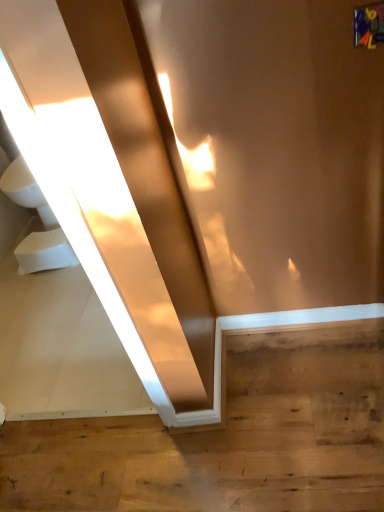
Question: Does white foam toilet bowl at lower left have a greater width compared to wooden floor at lower right?

Choices:
 (A) no
 (B) yes

Answer: (A)

Question: Does white foam toilet bowl at lower left touch wooden floor at lower right?

Choices:
 (A) yes
 (B) no

Answer: (B)

Question: Are white foam toilet bowl at lower left and wooden floor at lower right located far from each other?

Choices:
 (A) yes
 (B) no

Answer: (A)

Question: From a real-world perspective, is white foam toilet bowl at lower left physically above wooden floor at lower right?

Choices:
 (A) no
 (B) yes

Answer: (B)

Question: Can you confirm if white foam toilet bowl at lower left is bigger than wooden floor at lower right?

Choices:
 (A) no
 (B) yes

Answer: (A)

Question: From their relative heights in the image, would you say white foam toilet bowl at lower left is taller or shorter than white glossy sink at left?

Choices:
 (A) tall
 (B) short

Answer: (B)

Question: Is point (56, 227) closer or farther from the camera than point (14, 163)?

Choices:
 (A) closer
 (B) farther

Answer: (A)

Question: Do you think white foam toilet bowl at lower left is within white glossy sink at left, or outside of it?

Choices:
 (A) outside
 (B) inside

Answer: (A)

Question: Relative to white glossy sink at left, is white foam toilet bowl at lower left in front or behind?

Choices:
 (A) front
 (B) behind

Answer: (A)

Question: Is wooden floor at lower right inside the boundaries of white foam toilet bowl at lower left, or outside?

Choices:
 (A) outside
 (B) inside

Answer: (A)

Question: In terms of height, does wooden floor at lower right look taller or shorter compared to white foam toilet bowl at lower left?

Choices:
 (A) short
 (B) tall

Answer: (A)

Question: From the image's perspective, is wooden floor at lower right located above or below white foam toilet bowl at lower left?

Choices:
 (A) above
 (B) below

Answer: (B)

Question: Would you say wooden floor at lower right is to the left or to the right of white foam toilet bowl at lower left in the picture?

Choices:
 (A) left
 (B) right

Answer: (B)

Question: Does point (41, 259) appear closer or farther from the camera than point (301, 443)?

Choices:
 (A) closer
 (B) farther

Answer: (B)

Question: Is white foam toilet bowl at lower left bigger or smaller than wooden floor at lower right?

Choices:
 (A) small
 (B) big

Answer: (A)